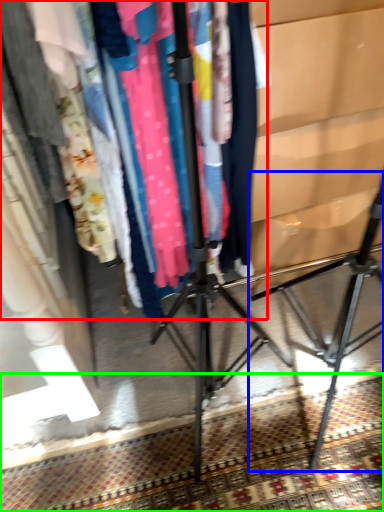
Question: Which object is the farthest from closet (highlighted by a red box)? Choose among these: tripod (highlighted by a blue box) or mat (highlighted by a green box).

Choices:
 (A) tripod
 (B) mat

Answer: (A)